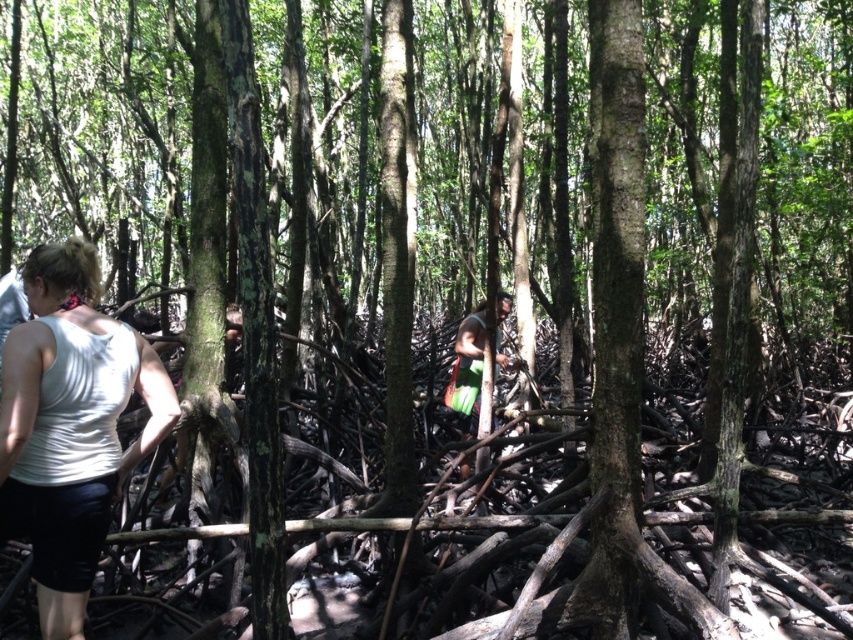
Question: Which point is farther to the camera?

Choices:
 (A) green fabric bag at center
 (B) white fabric at left

Answer: (A)

Question: Which of the following is the closest to the observer?

Choices:
 (A) white fabric at left
 (B) green fabric bag at center

Answer: (A)

Question: Can you confirm if white fabric at left is positioned to the left of green fabric bag at center?

Choices:
 (A) no
 (B) yes

Answer: (B)

Question: Observing the image, what is the correct spatial positioning of white fabric at left in reference to green fabric bag at center?

Choices:
 (A) above
 (B) below

Answer: (A)

Question: Is white fabric at left positioned at the back of green fabric bag at center?

Choices:
 (A) yes
 (B) no

Answer: (B)